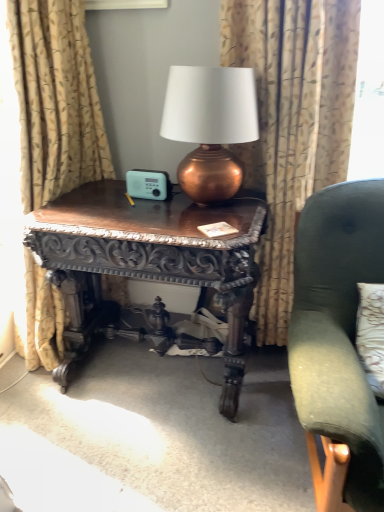
Question: Is velvet green armchair at right closer to camera compared to patterned fabric curtain at center, which is the 2th curtain in left-to-right order?

Choices:
 (A) yes
 (B) no

Answer: (A)

Question: Does velvet green armchair at right appear on the right side of patterned fabric curtain at center, the 1th curtain from the right?

Choices:
 (A) yes
 (B) no

Answer: (A)

Question: Would you consider velvet green armchair at right to be distant from patterned fabric curtain at center, the 1th curtain from the right?

Choices:
 (A) yes
 (B) no

Answer: (B)

Question: Would you say velvet green armchair at right contains patterned fabric curtain at center, which is the 2th curtain in left-to-right order?

Choices:
 (A) yes
 (B) no

Answer: (B)

Question: Is velvet green armchair at right taller than patterned fabric curtain at center, the 1th curtain from the right?

Choices:
 (A) no
 (B) yes

Answer: (A)

Question: Are velvet green armchair at right and patterned fabric curtain at center, the 1th curtain from the right, making contact?

Choices:
 (A) no
 (B) yes

Answer: (A)

Question: Considering the relative sizes of copper metallic lamp at center and dark wood carved table at center in the image provided, is copper metallic lamp at center taller than dark wood carved table at center?

Choices:
 (A) yes
 (B) no

Answer: (B)

Question: Can you confirm if copper metallic lamp at center is positioned to the right of dark wood carved table at center?

Choices:
 (A) no
 (B) yes

Answer: (B)

Question: Is the depth of copper metallic lamp at center greater than that of dark wood carved table at center?

Choices:
 (A) yes
 (B) no

Answer: (B)

Question: Is dark wood carved table at center a part of copper metallic lamp at center?

Choices:
 (A) no
 (B) yes

Answer: (A)

Question: From the image's perspective, does copper metallic lamp at center appear higher than dark wood carved table at center?

Choices:
 (A) no
 (B) yes

Answer: (B)

Question: Is copper metallic lamp at center touching dark wood carved table at center?

Choices:
 (A) no
 (B) yes

Answer: (A)

Question: From a real-world perspective, is velvet green armchair at right located higher than copper metallic lamp at center?

Choices:
 (A) no
 (B) yes

Answer: (A)